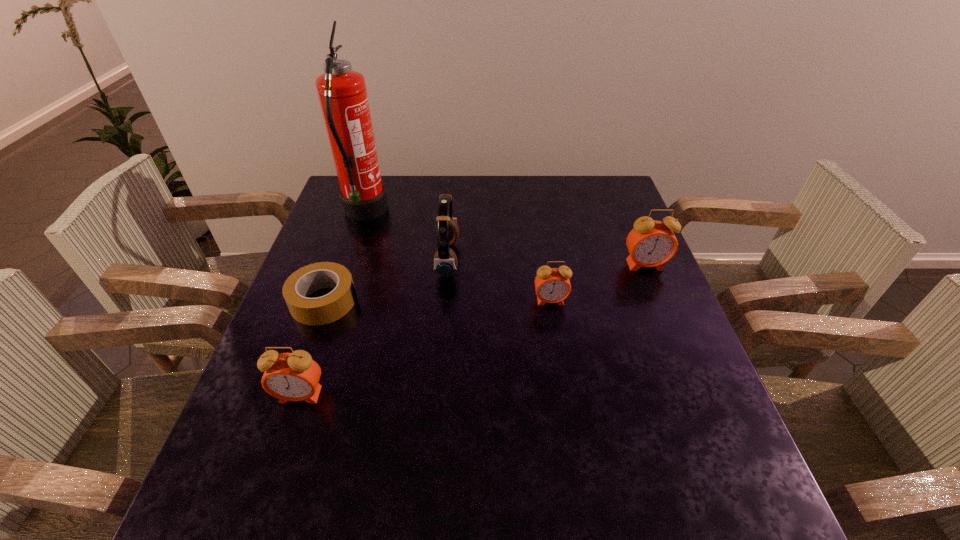
In order to click on object present at the right edge in this screenshot , I will do `click(651, 243)`.

This screenshot has height=540, width=960. I want to click on object that is at the far left corner, so click(342, 93).

In the image, there is a desktop. Where is `vacant space at the far edge`? This screenshot has width=960, height=540. vacant space at the far edge is located at coordinates (433, 182).

The width and height of the screenshot is (960, 540). I want to click on free space at the left edge of the desktop, so click(380, 220).

Locate an element on the screen. free region at the right edge of the desktop is located at coordinates (685, 351).

In the image, there is a desktop. Find the location of `vacant area at the near left corner`. vacant area at the near left corner is located at coordinates (267, 455).

Where is `free spot at the far right corner of the desktop`? free spot at the far right corner of the desktop is located at coordinates (612, 177).

Identify the location of vacant point located between the headset and the second alarm clock from left to right. (499, 280).

Locate an element on the screen. Image resolution: width=960 pixels, height=540 pixels. free spot between the duct tape and the fourth tallest object is located at coordinates (313, 348).

Identify the location of free space between the headset and the tallest object. (406, 237).